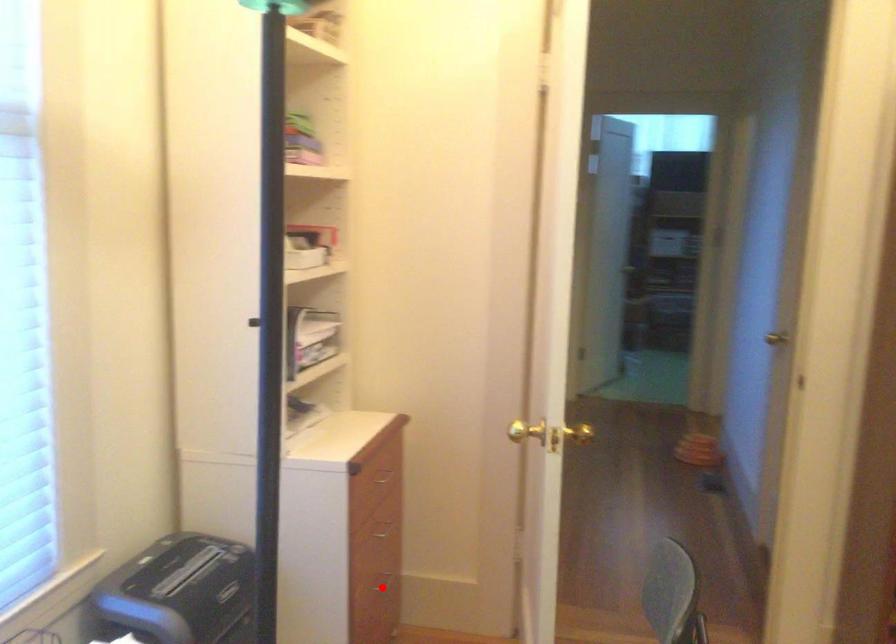
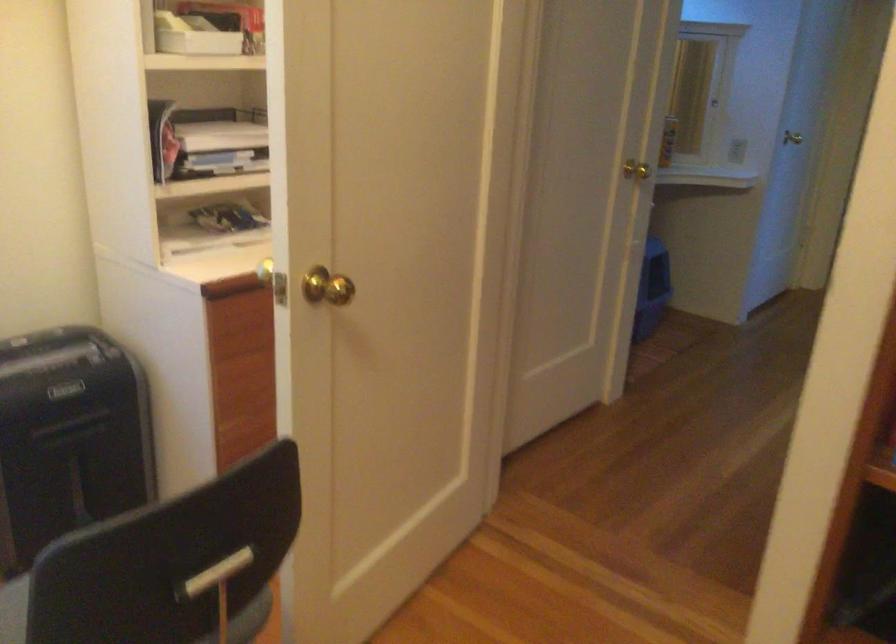
Question: I am providing you with two images of the same scene from different viewpoints. A red point is marked on the first image. Can you still see the location of the red point in image 2?

Choices:
 (A) Yes
 (B) No

Answer: (B)